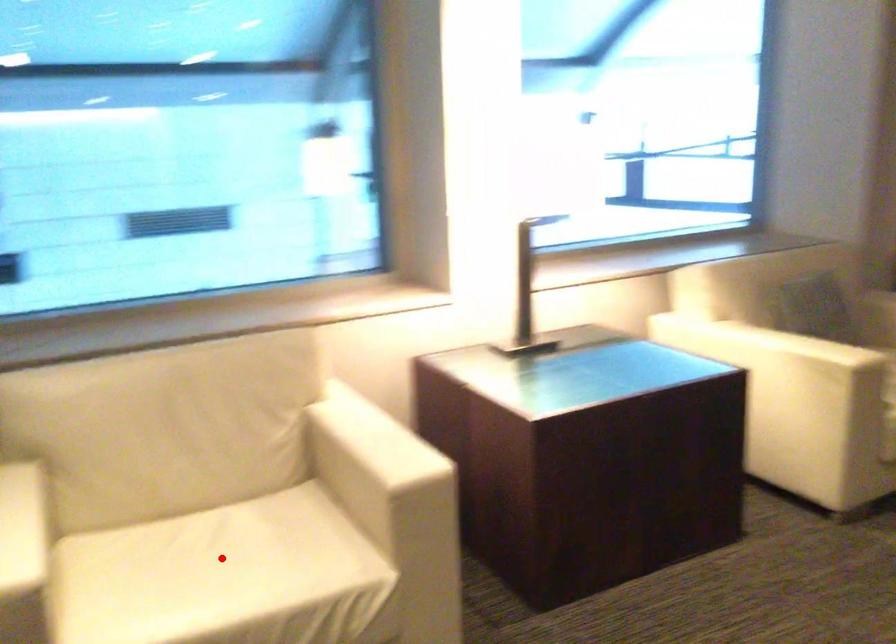
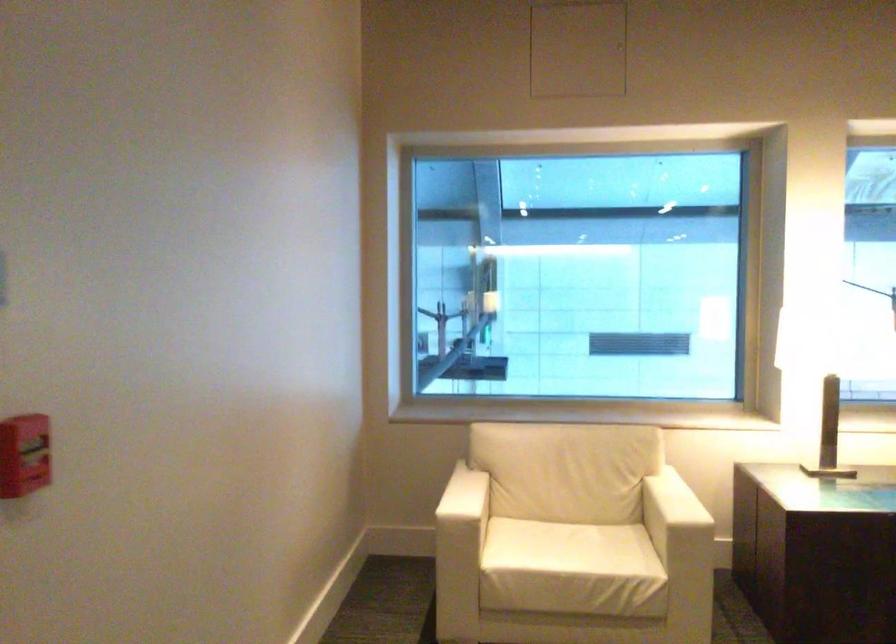
Question: A red point is marked in image1. In image2, is the corresponding 3D point closer to the camera or farther? Reply with the corresponding letter.

Choices:
 (A) The corresponding 3D point is closer.
 (B) The corresponding 3D point is farther.

Answer: (B)